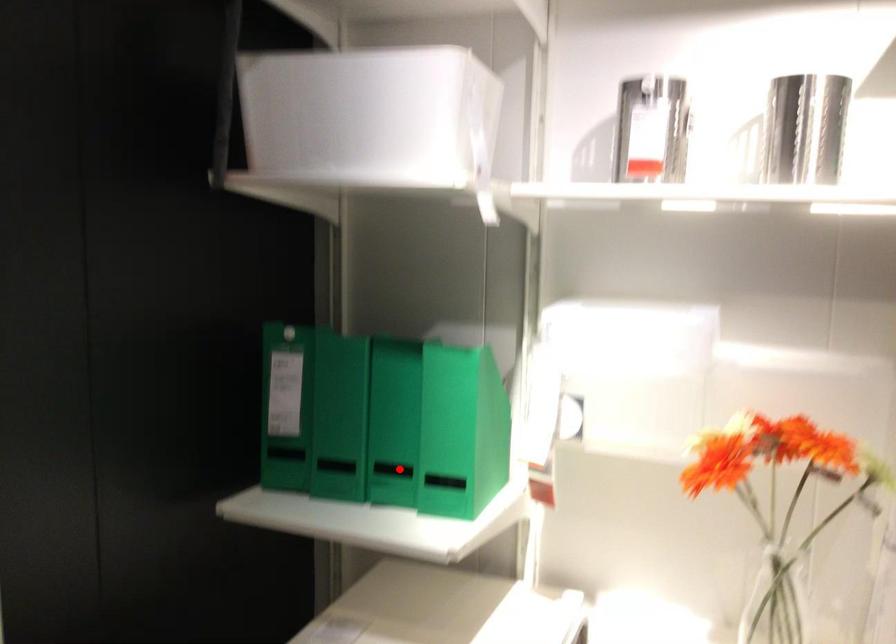
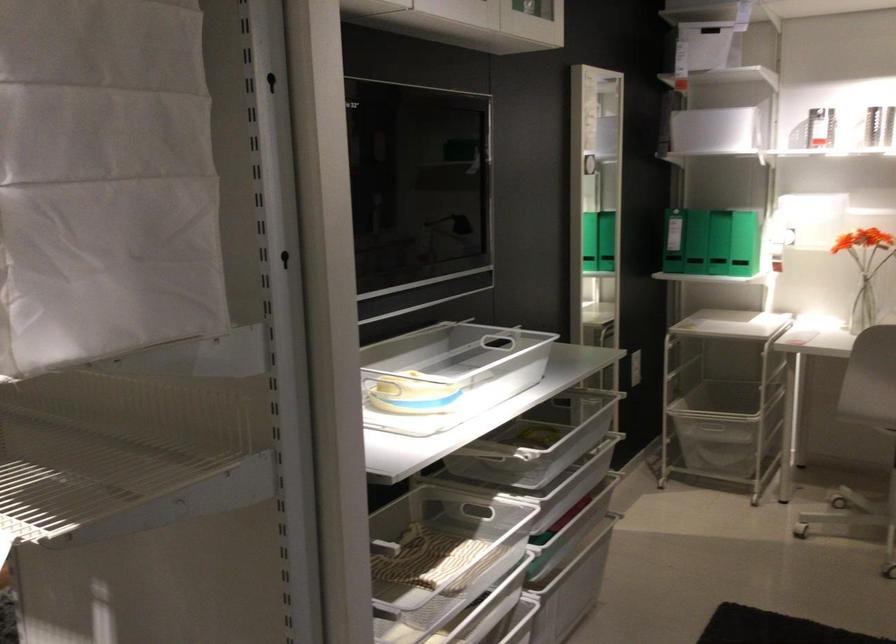
Question: I am providing you with two images of the same scene from different viewpoints. In image1, a red point is highlighted. Considering the same 3D point in image2, which of the following is correct?

Choices:
 (A) It is closer
 (B) It is farther

Answer: (B)